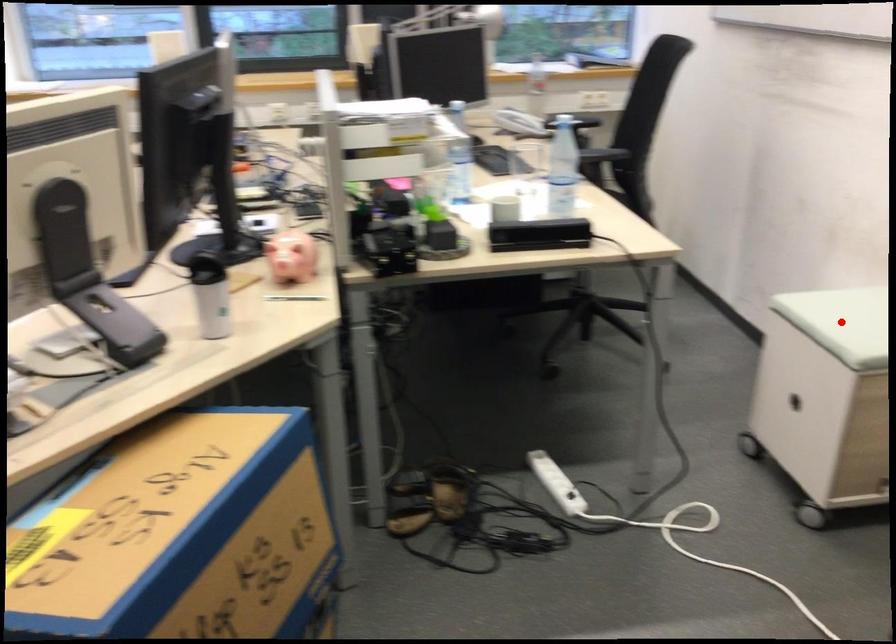
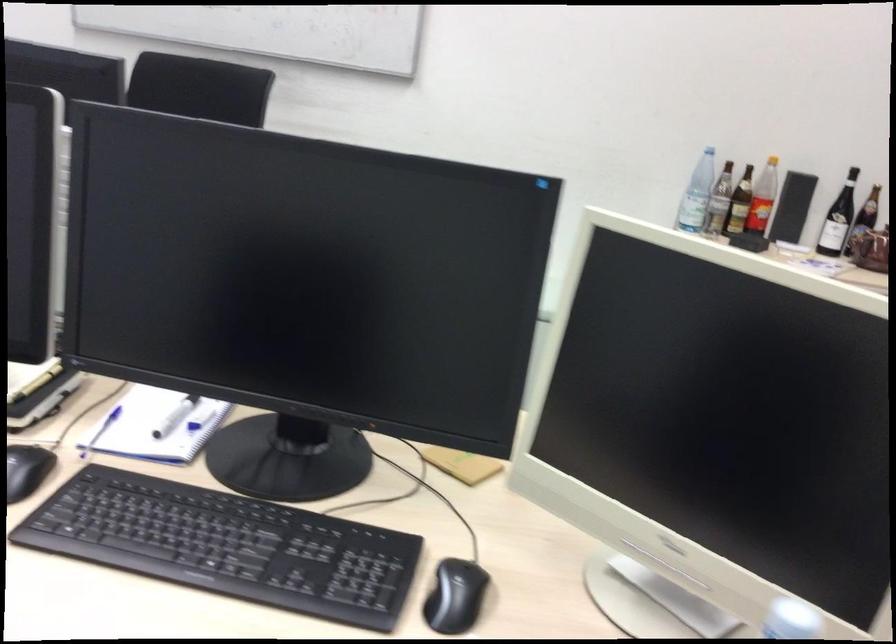
Question: I am providing you with two images of the same scene from different viewpoints. A red point is marked on the first image. Can you still see the location of the red point in image 2?

Choices:
 (A) Yes
 (B) No

Answer: (B)